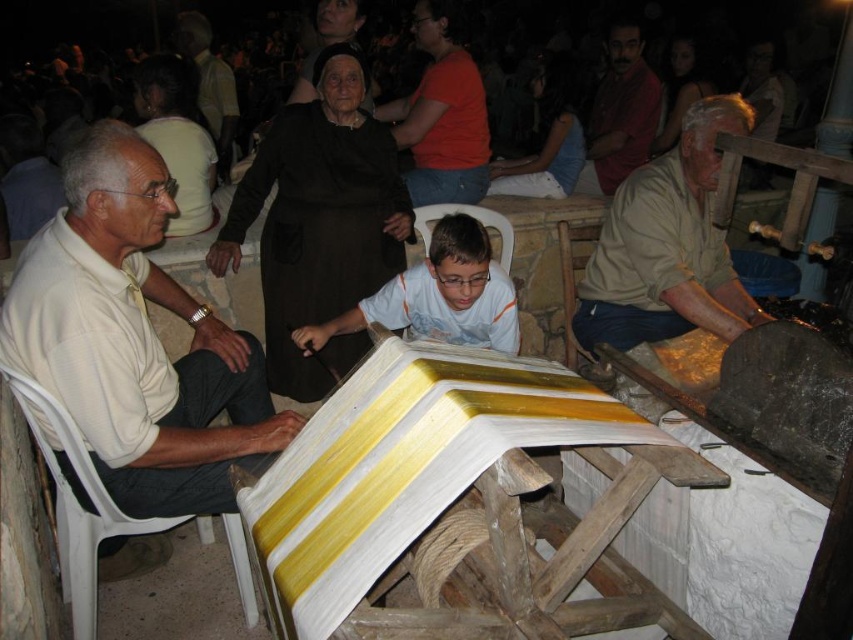
Can you confirm if white matte shirt at left is bigger than wooden chair at lower right?

Yes, white matte shirt at left is bigger than wooden chair at lower right.

Can you confirm if white matte shirt at left is wider than wooden chair at lower right?

Correct, the width of white matte shirt at left exceeds that of wooden chair at lower right.

Who is more forward, (213, 497) or (567, 252)?

Point (213, 497) is in front.

What are the coordinates of `white matte shirt at left` in the screenshot? It's located at (134, 339).

Can you confirm if white matte shirt at left is wider than beige fabric shirt at center?

Correct, the width of white matte shirt at left exceeds that of beige fabric shirt at center.

Does point (144, 426) come farther from viewer compared to point (727, 99)?

No, it is in front of (727, 99).

You are a GUI agent. You are given a task and a screenshot of the screen. Output one action in this format:
    pyautogui.click(x=<x>, y=<y>)
    Task: Click on the white matte shirt at left
    This screenshot has height=640, width=853.
    Given the screenshot: What is the action you would take?
    pyautogui.click(x=134, y=339)

Does white matte shirt at left have a larger size compared to white plastic chair at center?

Indeed, white matte shirt at left has a larger size compared to white plastic chair at center.

Between point (242, 340) and point (427, 225), which one is positioned in front?

Point (242, 340) is more forward.

You are a GUI agent. You are given a task and a screenshot of the screen. Output one action in this format:
    pyautogui.click(x=<x>, y=<y>)
    Task: Click on the white matte shirt at left
    The height and width of the screenshot is (640, 853).
    Given the screenshot: What is the action you would take?
    pyautogui.click(x=134, y=339)

Where is `white matte shirt at left`? The width and height of the screenshot is (853, 640). white matte shirt at left is located at coordinates (134, 339).